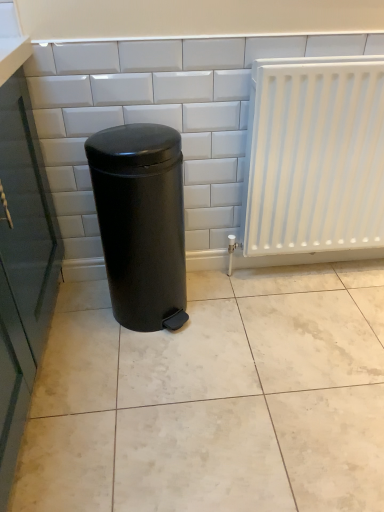
Locate an element on the screen. The image size is (384, 512). free space above black matte waste container at center (from a real-world perspective) is located at coordinates (130, 138).